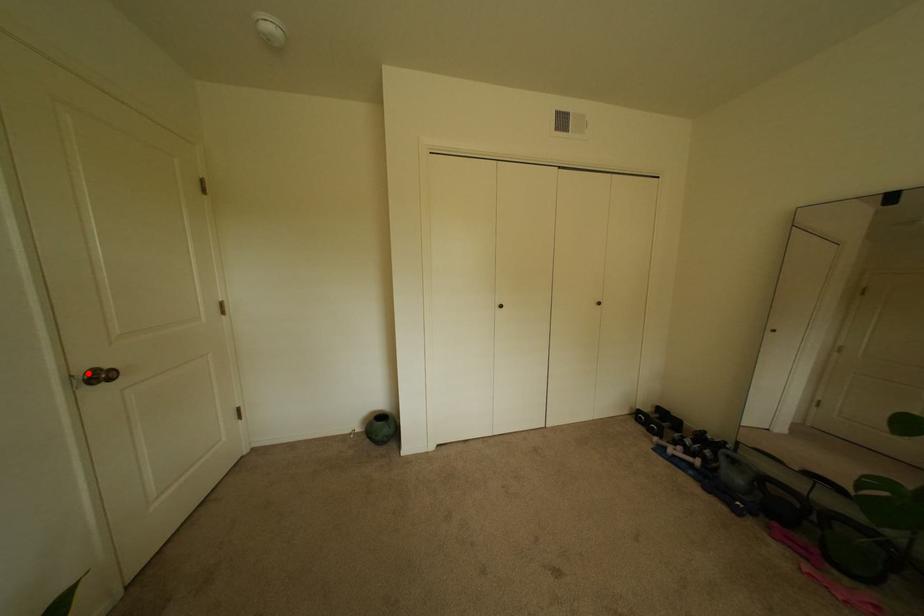
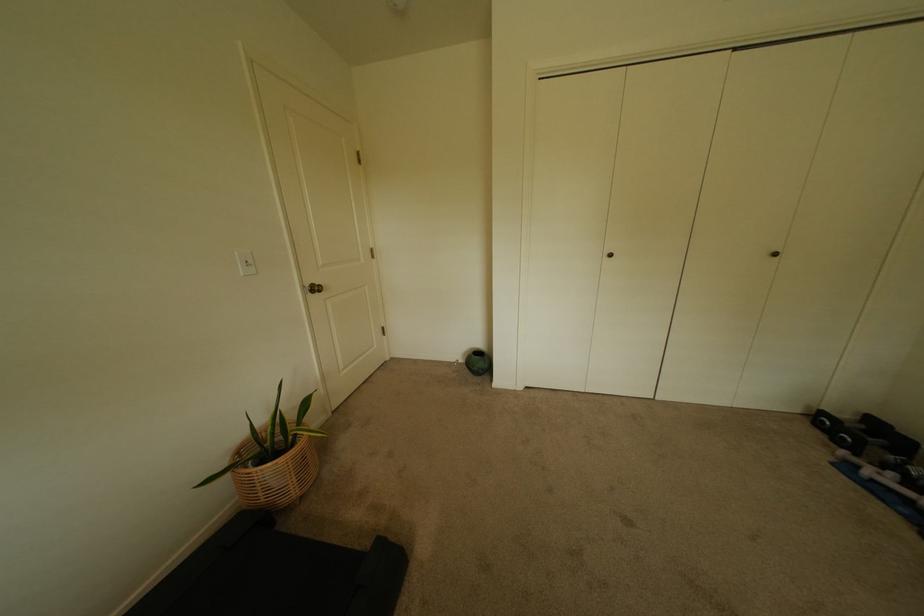
In the second image, find the point that corresponds to the highlighted location in the first image.

(315, 286)